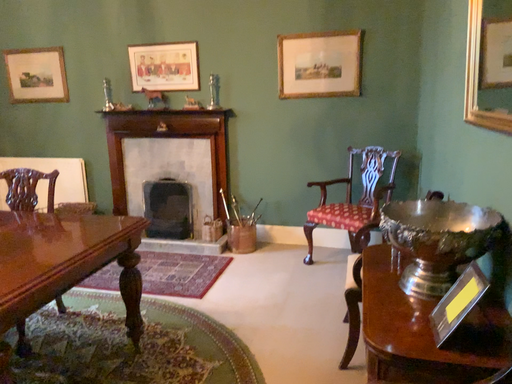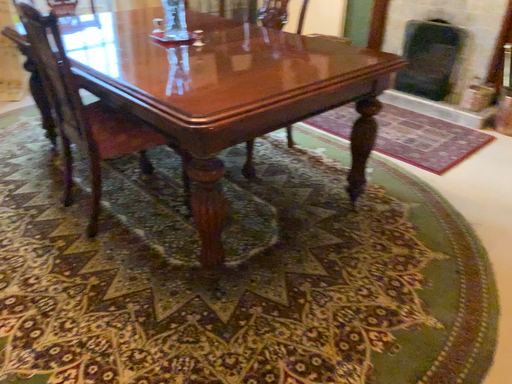
Question: Which way did the camera rotate in the video?

Choices:
 (A) rotated upward
 (B) rotated downward

Answer: (B)